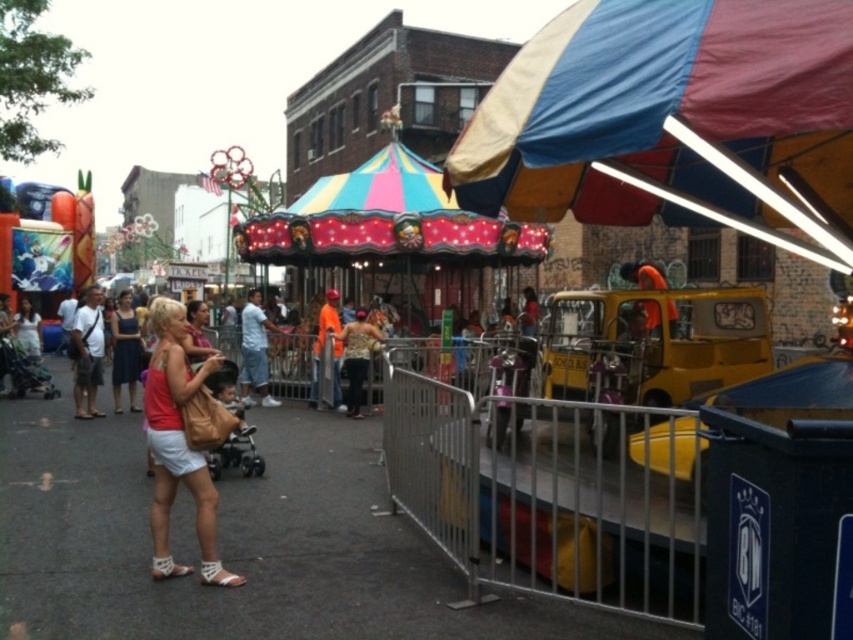
In the scene shown: Who is positioned more to the left, light blue denim shorts at center or printed fabric shirt at center?

Positioned to the left is light blue denim shorts at center.

Between light blue denim shorts at center and printed fabric shirt at center, which one is positioned lower?

printed fabric shirt at center

At what (x,y) coordinates should I click in order to perform the action: click on light blue denim shorts at center. Please return your answer as a coordinate pair (x, y). Looking at the image, I should click on (254, 349).

Which is more to the right, multicolored fabric canopy at upper right or matte pink blouse at center?

Positioned to the right is multicolored fabric canopy at upper right.

Does multicolored fabric canopy at upper right appear under matte pink blouse at center?

Actually, multicolored fabric canopy at upper right is above matte pink blouse at center.

What do you see at coordinates (666, 115) in the screenshot? This screenshot has height=640, width=853. I see `multicolored fabric canopy at upper right` at bounding box center [666, 115].

Where is `multicolored fabric canopy at upper right`? The width and height of the screenshot is (853, 640). multicolored fabric canopy at upper right is located at coordinates pyautogui.click(x=666, y=115).

Does matte blue dress at center have a larger size compared to orange fabric truck at center?

Yes, matte blue dress at center is bigger than orange fabric truck at center.

Is matte blue dress at center above orange fabric truck at center?

No.

Image resolution: width=853 pixels, height=640 pixels. I want to click on matte blue dress at center, so click(x=125, y=349).